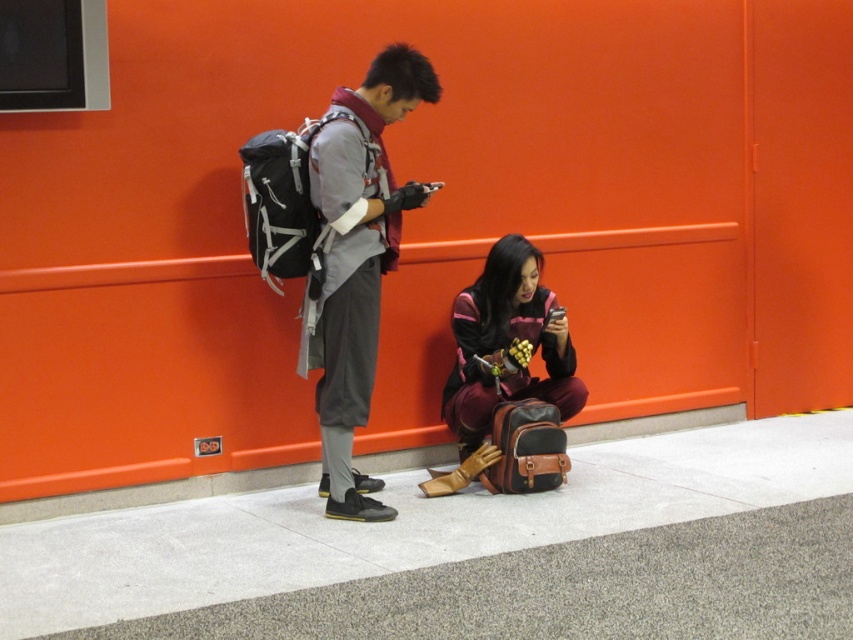
Question: Is the position of gray concrete pavement at lower center less distant than that of matte gray backpack at left?

Choices:
 (A) no
 (B) yes

Answer: (B)

Question: Is gray concrete pavement at lower center below matte gray backpack at left?

Choices:
 (A) no
 (B) yes

Answer: (B)

Question: Which of the following is the farthest from the observer?

Choices:
 (A) matte gray backpack at left
 (B) concrete curb at lower center
 (C) maroon leather jacket at lower center

Answer: (C)

Question: Which of the following is the closest to the observer?

Choices:
 (A) gray concrete pavement at lower center
 (B) concrete curb at lower center

Answer: (A)

Question: Among these objects, which one is farthest from the camera?

Choices:
 (A) matte gray backpack at left
 (B) gray concrete pavement at lower center

Answer: (A)

Question: Considering the relative positions of gray concrete pavement at lower center and matte gray backpack at left in the image provided, where is gray concrete pavement at lower center located with respect to matte gray backpack at left?

Choices:
 (A) above
 (B) below

Answer: (B)